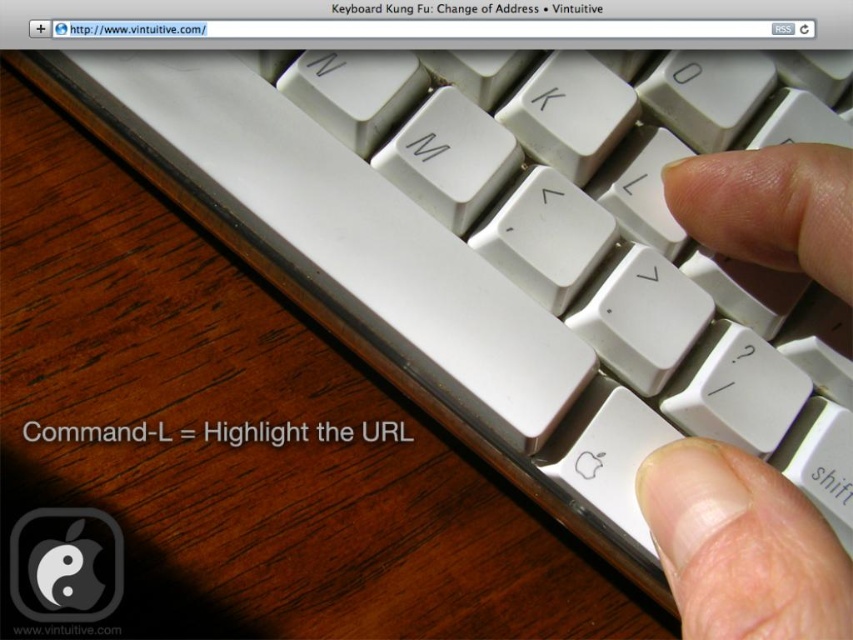
You are taking a photo of the keyboard and wooden surface. You want to focus on the point closer to the camera. Which point should you choose between point (666,186) and point (769,547)?

Point (666,186) is further to the camera than point (769,547), so you should choose point (666,186) to focus on the closer point.

You are trying to determine which finger is closer to you in the image. You see a white plastic finger at center and a white matte finger at lower right. Based on their positions, which finger is closer to you?

The white plastic finger at center is closer to you because it is in front of the white matte finger at lower right.

You are designing a tactile feedback system for a keyboard and need to place two different types of fingers on the Command key. The white plastic finger at center and the white matte finger at lower right must both be placed on the Command key. Which finger will you choose to ensure it is more prominent for users to feel?

The white plastic finger at center has a greater height compared to the white matte finger at lower right, so it will be more prominent for users to feel and should be chosen for the tactile feedback system.